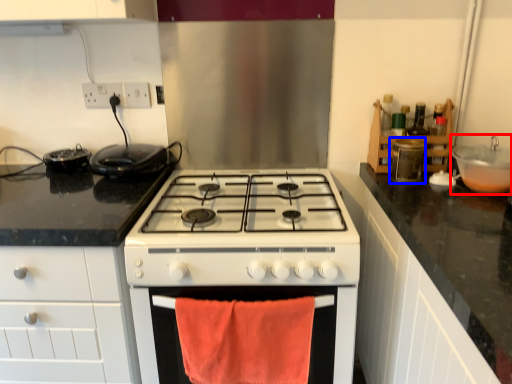
Question: Which point is further to the camera, sink (highlighted by a red box) or appliance (highlighted by a blue box)?

Choices:
 (A) sink
 (B) appliance

Answer: (B)